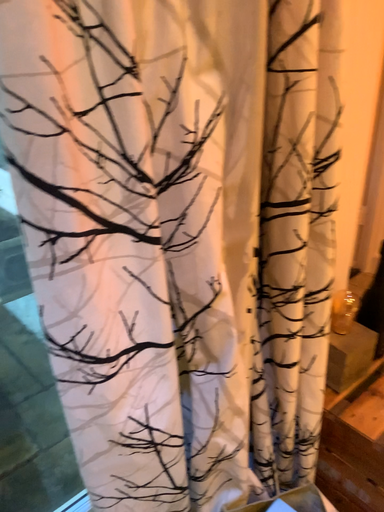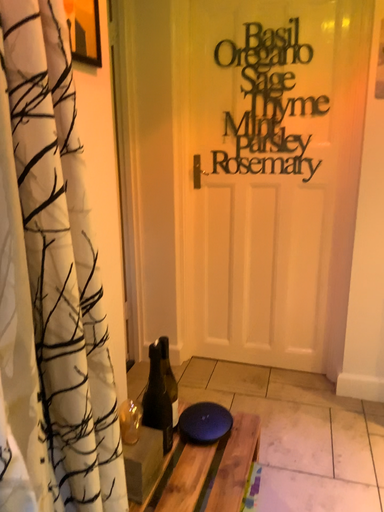
Question: Which way did the camera rotate in the video?

Choices:
 (A) rotated downward
 (B) rotated upward

Answer: (B)